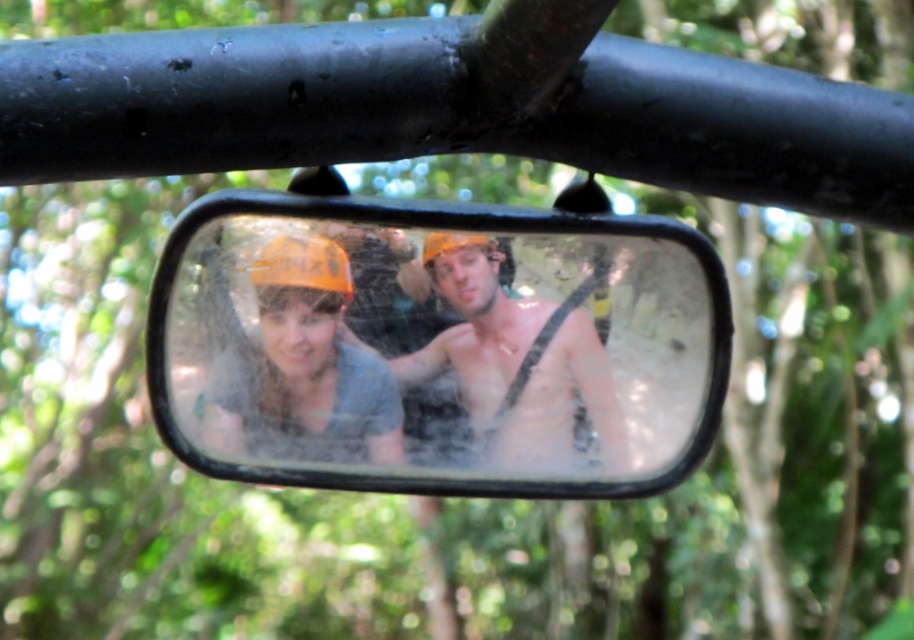
Question: Considering the real-world distances, which object is closest to the shiny silver helmet at center?

Choices:
 (A) orange matte helmet at center
 (B) clear glass mirror at center

Answer: (B)

Question: Is shiny silver helmet at center positioned before orange matte helmet at center?

Choices:
 (A) no
 (B) yes

Answer: (A)

Question: Can you confirm if clear glass mirror at center is positioned below orange matte helmet at center?

Choices:
 (A) yes
 (B) no

Answer: (B)

Question: Which object appears farthest from the camera in this image?

Choices:
 (A) clear glass mirror at center
 (B) orange matte helmet at center
 (C) shiny silver helmet at center

Answer: (C)

Question: Which of the following is the closest to the observer?

Choices:
 (A) (476, 244)
 (B) (231, 419)

Answer: (A)

Question: Is clear glass mirror at center to the right of orange matte helmet at center from the viewer's perspective?

Choices:
 (A) yes
 (B) no

Answer: (A)